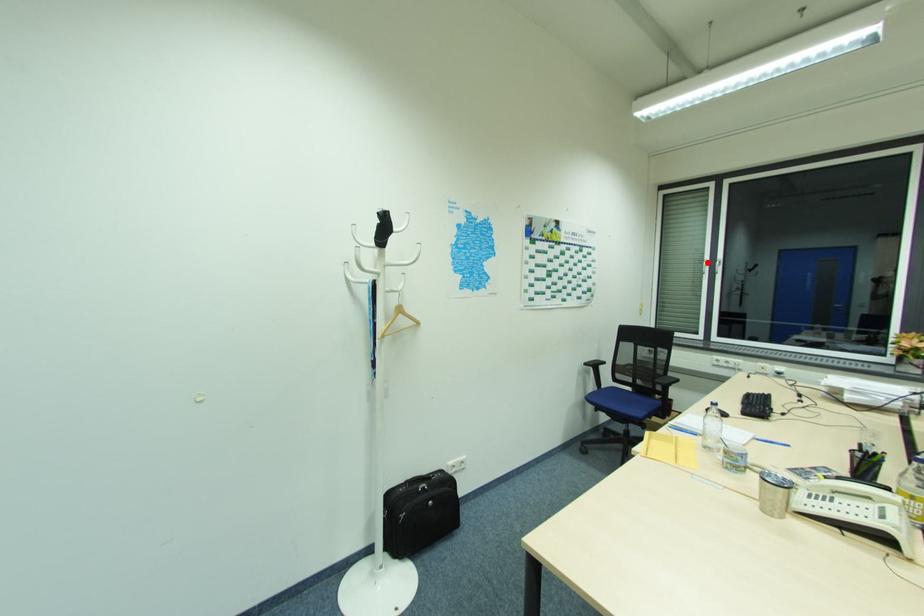
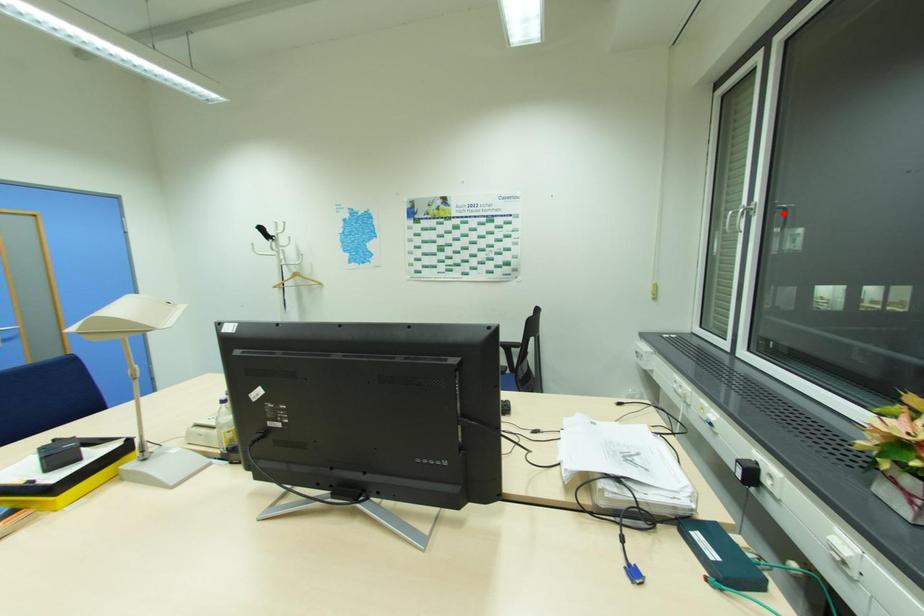
I am providing you with two images of the same scene from different viewpoints. A red point is marked on the first image and another point is marked on the second image. Are the points marked in image1 and image2 representing the same 3D position?

No